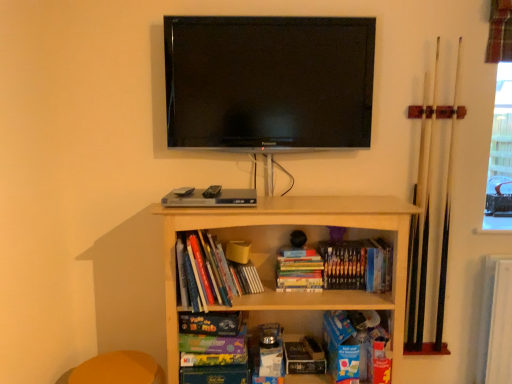
Question: Is hardcover books at center, the first book viewed from the left, in front of matte purple paperback book at center, which is the 2th paperback book from right to left?

Choices:
 (A) yes
 (B) no

Answer: (A)

Question: Does hardcover books at center, which appears as the third book when viewed from the right, have a greater height compared to matte purple paperback book at center, which is the 2th paperback book from right to left?

Choices:
 (A) yes
 (B) no

Answer: (A)

Question: Considering the relative sizes of hardcover books at center, the first book viewed from the left, and matte purple paperback book at center, which is counted as the 2th paperback book, starting from the bottom, in the image provided, is hardcover books at center, the first book viewed from the left, shorter than matte purple paperback book at center, which is counted as the 2th paperback book, starting from the bottom,?

Choices:
 (A) no
 (B) yes

Answer: (A)

Question: From the image's perspective, is hardcover books at center, which appears as the third book when viewed from the right, under matte purple paperback book at center, which is the 2th paperback book from right to left?

Choices:
 (A) no
 (B) yes

Answer: (A)

Question: Is hardcover books at center, which appears as the third book when viewed from the right, facing towards matte purple paperback book at center, which is counted as the 2th paperback book, starting from the bottom?

Choices:
 (A) no
 (B) yes

Answer: (A)

Question: Is hardcover books at center, the first book viewed from the left, positioned far away from matte purple paperback book at center, the second paperback book when ordered from left to right?

Choices:
 (A) yes
 (B) no

Answer: (B)

Question: Is hardcover books at center, which is the second book from left to right, bigger than hardcover book at center, which is the 1th book from right to left?

Choices:
 (A) no
 (B) yes

Answer: (A)

Question: Can you confirm if hardcover books at center, arranged as the second book when viewed from the right, is wider than hardcover book at center, which is the 1th book from right to left?

Choices:
 (A) no
 (B) yes

Answer: (A)

Question: Considering the relative sizes of hardcover books at center, arranged as the second book when viewed from the right, and hardcover book at center, which is counted as the third book, starting from the left, in the image provided, is hardcover books at center, arranged as the second book when viewed from the right, smaller than hardcover book at center, which is counted as the third book, starting from the left,?

Choices:
 (A) yes
 (B) no

Answer: (A)

Question: From a real-world perspective, is hardcover books at center, arranged as the second book when viewed from the right, positioned over hardcover book at center, which is counted as the third book, starting from the left, based on gravity?

Choices:
 (A) no
 (B) yes

Answer: (A)

Question: Considering the relative sizes of hardcover books at center, arranged as the second book when viewed from the right, and hardcover book at center, which is the 1th book from right to left, in the image provided, is hardcover books at center, arranged as the second book when viewed from the right, shorter than hardcover book at center, which is the 1th book from right to left,?

Choices:
 (A) no
 (B) yes

Answer: (B)

Question: Is hardcover books at center, arranged as the second book when viewed from the right, closer to camera compared to hardcover book at center, which is counted as the third book, starting from the left?

Choices:
 (A) yes
 (B) no

Answer: (B)

Question: From the image's perspective, would you say hardcover book at center, which is the 1th book from right to left, is shown under flat screen tv at upper center?

Choices:
 (A) yes
 (B) no

Answer: (A)